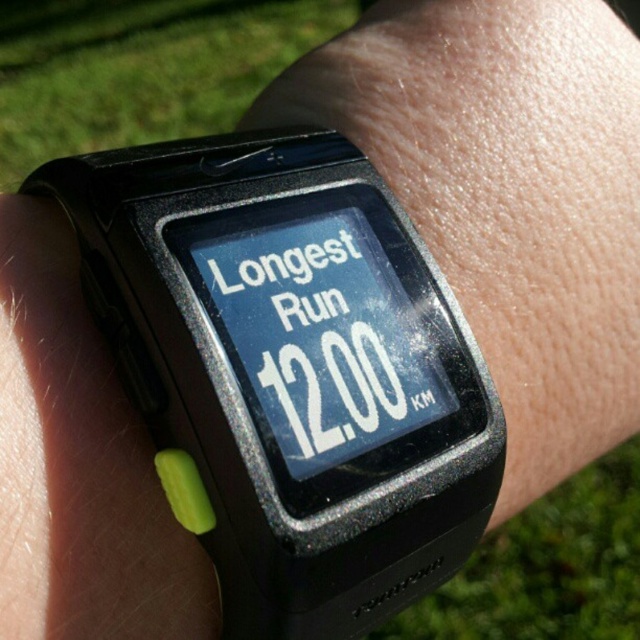
Can you confirm if black plastic watch at center is shorter than black rubber watch at center?

Yes, black plastic watch at center is shorter than black rubber watch at center.

Is point (392, 486) closer to viewer compared to point (515, 332)?

Yes, it is in front of point (515, 332).

Between point (374, 253) and point (602, 232), which one is positioned behind?

The point (602, 232) is behind.

Locate an element on the screen. The width and height of the screenshot is (640, 640). black plastic watch at center is located at coordinates (291, 368).